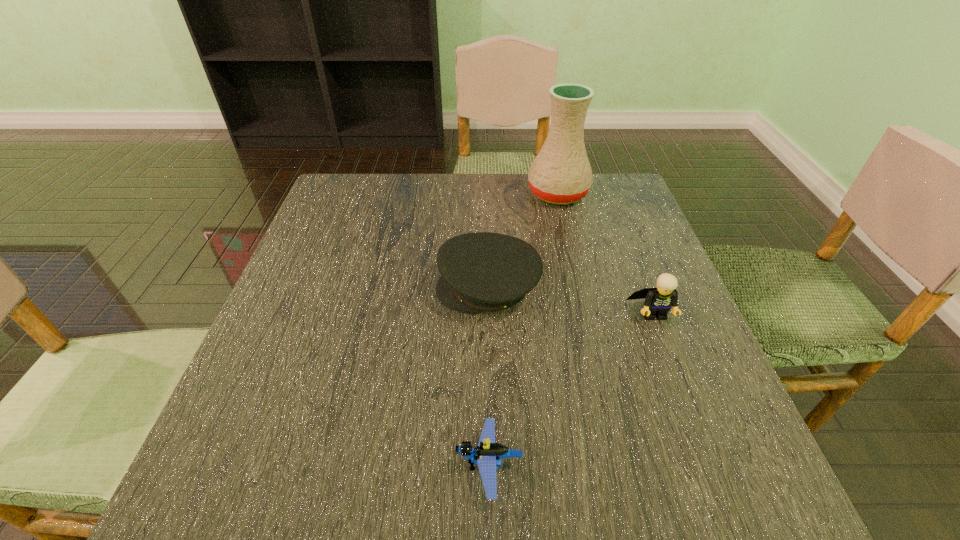
Where is `pottery`? pottery is located at coordinates (561, 174).

This screenshot has height=540, width=960. What are the coordinates of `the tallest object` in the screenshot? It's located at (561, 174).

Where is `the farther Lego`? This screenshot has height=540, width=960. the farther Lego is located at coordinates (659, 300).

What are the coordinates of `the right Lego` in the screenshot? It's located at (659, 300).

At what (x,y) coordinates should I click in order to perform the action: click on beret. Please return your answer as a coordinate pair (x, y). The image size is (960, 540). Looking at the image, I should click on (483, 271).

Find the location of a particular element. the nearest object is located at coordinates pyautogui.click(x=488, y=454).

You are a GUI agent. You are given a task and a screenshot of the screen. Output one action in this format:
    pyautogui.click(x=<x>, y=<y>)
    Task: Click on the shortest object
    Image resolution: width=960 pixels, height=540 pixels.
    Given the screenshot: What is the action you would take?
    pyautogui.click(x=488, y=454)

Where is `vacant point located 0.320m on the left of the pottery`? vacant point located 0.320m on the left of the pottery is located at coordinates (409, 193).

At what (x,y) coordinates should I click in order to perform the action: click on vacant space located 0.100m on the front-facing side of the right Lego. Please return your answer as a coordinate pair (x, y). Looking at the image, I should click on (675, 368).

This screenshot has height=540, width=960. Identify the location of vacant space situated on the front-facing side of the beret. (388, 288).